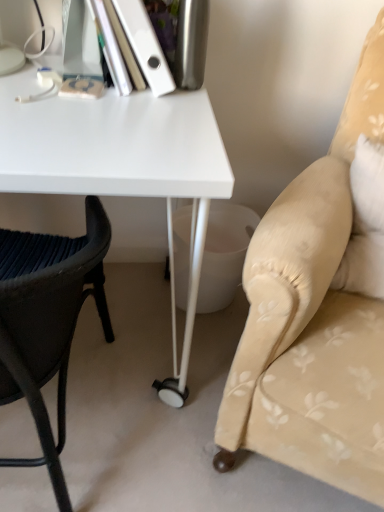
Question: Is white matte book at upper left turned away from beige fabric cushion at right, acting as the first chair starting from the right?

Choices:
 (A) yes
 (B) no

Answer: (B)

Question: Does white matte book at upper left turn towards beige fabric cushion at right, acting as the first chair starting from the right?

Choices:
 (A) yes
 (B) no

Answer: (B)

Question: Would you say white matte book at upper left is outside beige fabric cushion at right, acting as the first chair starting from the right?

Choices:
 (A) no
 (B) yes

Answer: (B)

Question: Considering the relative sizes of white matte book at upper left and beige fabric cushion at right, acting as the first chair starting from the right, in the image provided, is white matte book at upper left bigger than beige fabric cushion at right, acting as the first chair starting from the right,?

Choices:
 (A) yes
 (B) no

Answer: (B)

Question: From the image's perspective, is white matte book at upper left located beneath beige fabric cushion at right, acting as the first chair starting from the right?

Choices:
 (A) no
 (B) yes

Answer: (A)

Question: Do you think white matte book at upper left is within black woven chair at left, which ranks as the first chair in left-to-right order, or outside of it?

Choices:
 (A) inside
 (B) outside

Answer: (B)

Question: In the image, is white matte book at upper left positioned in front of or behind black woven chair at left, marked as the second chair in a right-to-left arrangement?

Choices:
 (A) behind
 (B) front

Answer: (A)

Question: From a real-world perspective, is white matte book at upper left above or below black woven chair at left, marked as the second chair in a right-to-left arrangement?

Choices:
 (A) below
 (B) above

Answer: (B)

Question: In the image, is white matte book at upper left on the left side or the right side of black woven chair at left, which ranks as the first chair in left-to-right order?

Choices:
 (A) left
 (B) right

Answer: (B)

Question: From a real-world perspective, is black woven chair at left, which ranks as the first chair in left-to-right order, physically located above or below white matte book at upper left?

Choices:
 (A) above
 (B) below

Answer: (B)

Question: Considering the positions of black woven chair at left, marked as the second chair in a right-to-left arrangement, and white matte book at upper left in the image, is black woven chair at left, marked as the second chair in a right-to-left arrangement, taller or shorter than white matte book at upper left?

Choices:
 (A) short
 (B) tall

Answer: (B)

Question: Considering the positions of black woven chair at left, marked as the second chair in a right-to-left arrangement, and white matte book at upper left in the image, is black woven chair at left, marked as the second chair in a right-to-left arrangement, wider or thinner than white matte book at upper left?

Choices:
 (A) thin
 (B) wide

Answer: (B)

Question: Is black woven chair at left, marked as the second chair in a right-to-left arrangement, bigger or smaller than white matte book at upper left?

Choices:
 (A) small
 (B) big

Answer: (B)

Question: From the image's perspective, is black woven chair at left, which ranks as the first chair in left-to-right order, above or below white glossy desk at center?

Choices:
 (A) above
 (B) below

Answer: (B)

Question: Looking at the image, does black woven chair at left, which ranks as the first chair in left-to-right order, seem bigger or smaller compared to white glossy desk at center?

Choices:
 (A) big
 (B) small

Answer: (B)